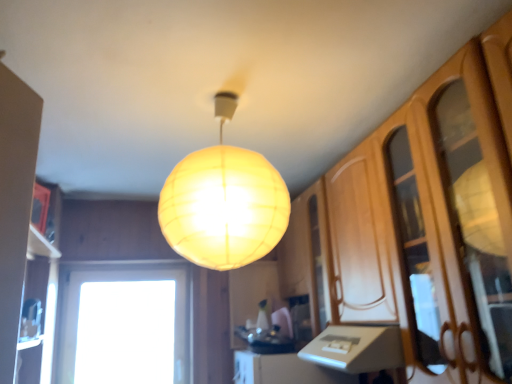
Measure the distance between point (116, 337) and camera.

The distance of point (116, 337) from camera is 2.89 meters.

Locate an element on the screen. This screenshot has width=512, height=384. translucent yellow sphere at center is located at coordinates (224, 202).

The width and height of the screenshot is (512, 384). Describe the element at coordinates (424, 223) in the screenshot. I see `wooden cabinet at right` at that location.

Image resolution: width=512 pixels, height=384 pixels. I want to click on transparent glass window at lower left, so click(123, 324).

From the image's perspective, which one is positioned lower, translucent yellow sphere at center or wooden cabinet at right?

wooden cabinet at right, from the image's perspective.

Does point (241, 168) come in front of point (358, 301)?

Yes, point (241, 168) is in front of point (358, 301).

Which object is thinner, translucent yellow sphere at center or wooden cabinet at right?

With smaller width is wooden cabinet at right.

What's the angular difference between transparent glass window at lower left and translucent yellow sphere at center's facing directions?

The angle between the facing direction of transparent glass window at lower left and the facing direction of translucent yellow sphere at center is 0.604 degrees.

Can you confirm if transparent glass window at lower left is positioned to the right of translucent yellow sphere at center?

Incorrect, transparent glass window at lower left is not on the right side of translucent yellow sphere at center.

At what (x,y) coordinates should I click in order to perform the action: click on lamp that is above the transparent glass window at lower left (from the image's perspective). Please return your answer as a coordinate pair (x, y). This screenshot has width=512, height=384. Looking at the image, I should click on (224, 202).

Would you say transparent glass window at lower left is outside translucent yellow sphere at center?

Yes, transparent glass window at lower left is located beyond the bounds of translucent yellow sphere at center.

Can you confirm if transparent glass window at lower left is shorter than wooden cabinet at right?

Yes, transparent glass window at lower left is shorter than wooden cabinet at right.

Considering the sizes of objects transparent glass window at lower left and wooden cabinet at right in the image provided, who is wider, transparent glass window at lower left or wooden cabinet at right?

With larger width is wooden cabinet at right.

Are transparent glass window at lower left and wooden cabinet at right located far from each other?

Yes, transparent glass window at lower left and wooden cabinet at right are located far from each other.

Is transparent glass window at lower left looking in the opposite direction of wooden cabinet at right?

No, transparent glass window at lower left is not facing away from wooden cabinet at right.

The height and width of the screenshot is (384, 512). Identify the location of window on the left side of wooden cabinet at right. (123, 324).

Does wooden cabinet at right contain transparent glass window at lower left?

That's incorrect, transparent glass window at lower left is not inside wooden cabinet at right.

Is wooden cabinet at right beside transparent glass window at lower left?

No, wooden cabinet at right is not with transparent glass window at lower left.

Which of these two, wooden cabinet at right or transparent glass window at lower left, stands shorter?

transparent glass window at lower left is shorter.

Is translucent yellow sphere at center to the left or to the right of transparent glass window at lower left in the image?

translucent yellow sphere at center is positioned on transparent glass window at lower left's right side.

Considering the relative sizes of translucent yellow sphere at center and transparent glass window at lower left in the image provided, is translucent yellow sphere at center shorter than transparent glass window at lower left?

Correct, translucent yellow sphere at center is not as tall as transparent glass window at lower left.

Can you tell me how much translucent yellow sphere at center and transparent glass window at lower left differ in facing direction?

0.604 degrees separate the facing orientations of translucent yellow sphere at center and transparent glass window at lower left.

Is translucent yellow sphere at center located outside transparent glass window at lower left?

Yes.

You are a GUI agent. You are given a task and a screenshot of the screen. Output one action in this format:
    pyautogui.click(x=<x>, y=<y>)
    Task: Click on the lamp behind the wooden cabinet at right
    This screenshot has width=512, height=384.
    Given the screenshot: What is the action you would take?
    pyautogui.click(x=224, y=202)

Is wooden cabinet at right at the left side of translucent yellow sphere at center?

In fact, wooden cabinet at right is to the right of translucent yellow sphere at center.

Is wooden cabinet at right outside of translucent yellow sphere at center?

Absolutely, wooden cabinet at right is external to translucent yellow sphere at center.

Based on the photo, from the image's perspective, is wooden cabinet at right located above or below translucent yellow sphere at center?

Based on their image positions, wooden cabinet at right is located beneath translucent yellow sphere at center.

Identify the location of lamp lying above the wooden cabinet at right (from the image's perspective). (224, 202).

Identify the location of lamp in front of the transparent glass window at lower left. (224, 202).

Looking at the image, which one is located closer to wooden cabinet at right, translucent yellow sphere at center or transparent glass window at lower left?

translucent yellow sphere at center is positioned closer to the anchor wooden cabinet at right.

When comparing their distances from transparent glass window at lower left, does wooden cabinet at right or translucent yellow sphere at center seem closer?

wooden cabinet at right is positioned closer to the anchor transparent glass window at lower left.

Based on their spatial positions, is wooden cabinet at right or transparent glass window at lower left further from translucent yellow sphere at center?

transparent glass window at lower left is further to translucent yellow sphere at center.

Looking at the image, which one is located further to transparent glass window at lower left, translucent yellow sphere at center or wooden cabinet at right?

translucent yellow sphere at center lies further to transparent glass window at lower left than the other object.

When comparing their distances from translucent yellow sphere at center, does transparent glass window at lower left or wooden cabinet at right seem closer?

wooden cabinet at right is closer to translucent yellow sphere at center.

Based on the photo, looking at the image, which one is located closer to wooden cabinet at right, transparent glass window at lower left or translucent yellow sphere at center?

translucent yellow sphere at center lies closer to wooden cabinet at right than the other object.

Image resolution: width=512 pixels, height=384 pixels. I want to click on lamp between wooden cabinet at right and transparent glass window at lower left in the front-back direction, so click(x=224, y=202).